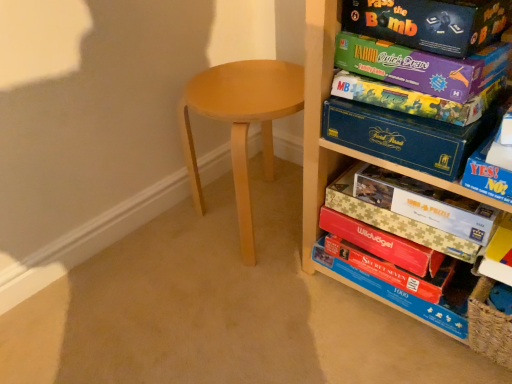
Where is `empty space that is in between light brown wood stool at center and wooden shelf at right`? This screenshot has height=384, width=512. empty space that is in between light brown wood stool at center and wooden shelf at right is located at coordinates (337, 291).